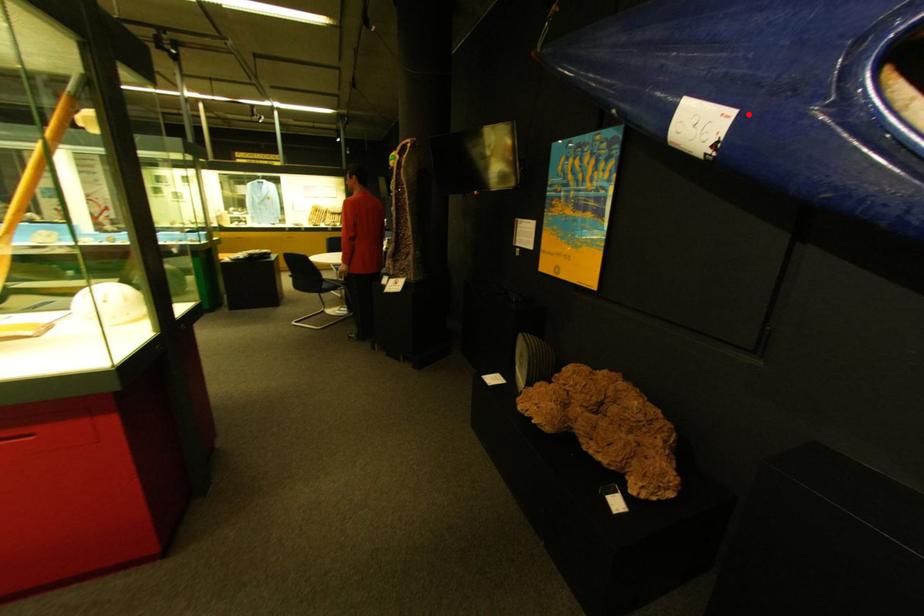
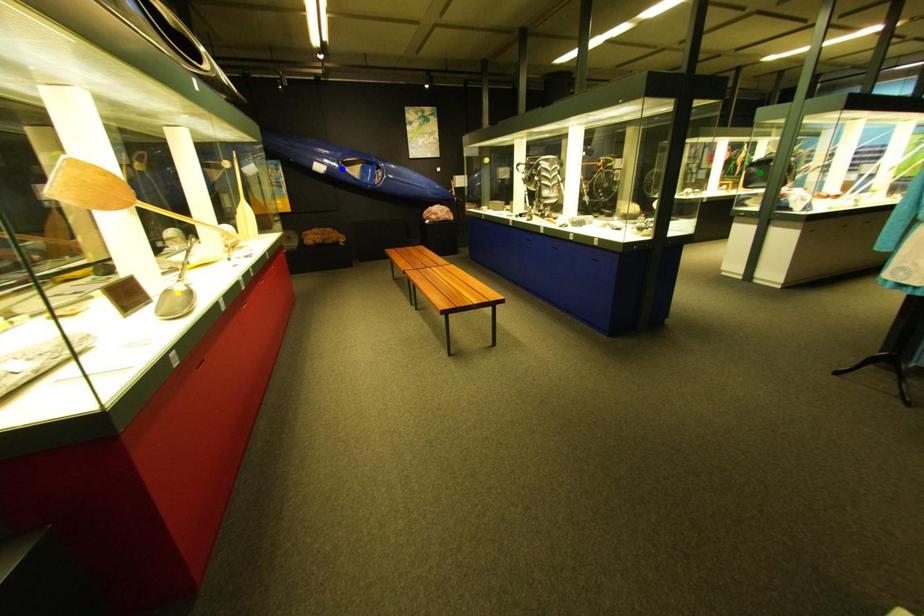
Question: I am providing you with two images of the same scene from different viewpoints. A red point is marked on the first image. You are given multiple points on the second image. Can you choose the point in image 2 that corresponds to the point in image 1?

Choices:
 (A) green point
 (B) blue point
 (C) yellow point

Answer: (B)